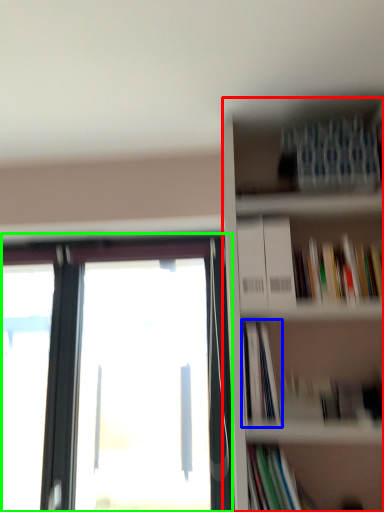
Question: Estimate the real-world distances between objects in this image. Which object is closer to bookcase (highlighted by a red box), book (highlighted by a blue box) or window (highlighted by a green box)?

Choices:
 (A) book
 (B) window

Answer: (A)